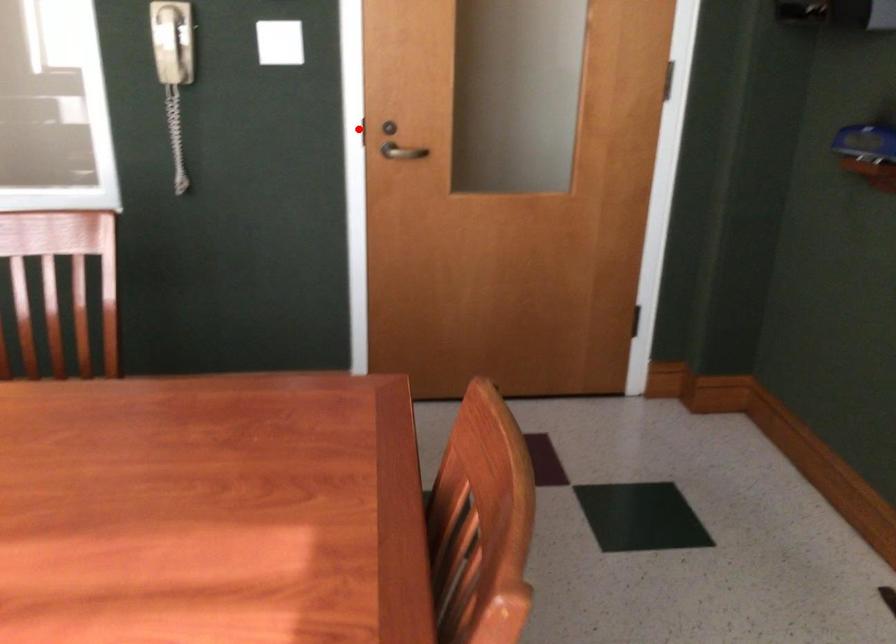
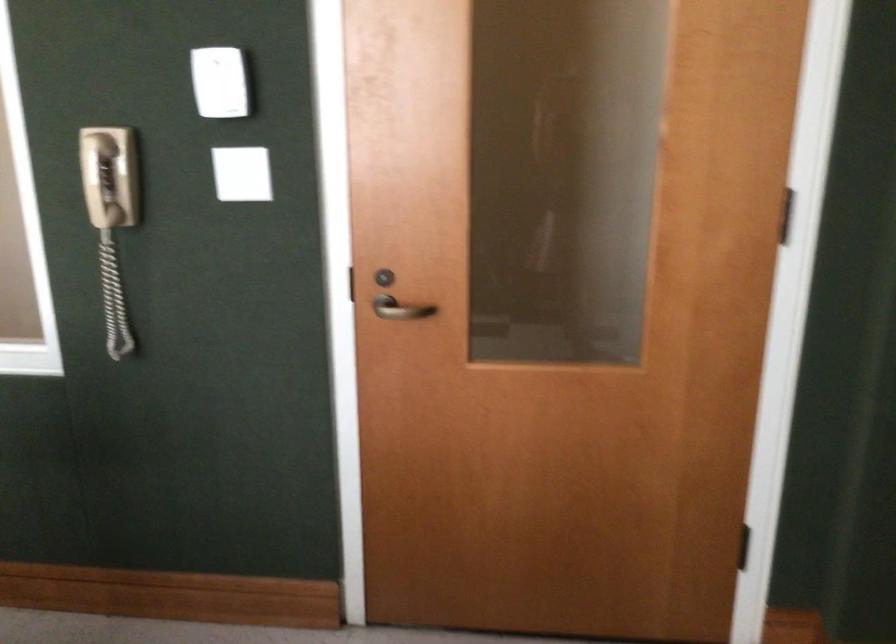
Find the pixel in the second image that matches the highlighted location in the first image.

(346, 283)